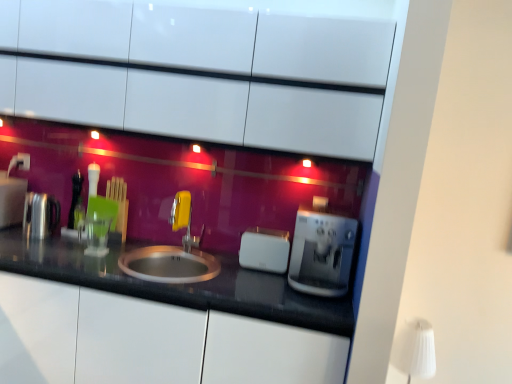
Question: Based on their positions, is white glossy cabinets at upper center located to the left or right of black granite countertop at center?

Choices:
 (A) right
 (B) left

Answer: (A)

Question: Is point [x=97, y=41] positioned closer to the camera than point [x=304, y=319]?

Choices:
 (A) closer
 (B) farther

Answer: (B)

Question: Estimate the real-world distances between objects in this image. Which object is farther from the polished stainless steel kettle at left, positioned as the 1th appliance in left-to-right order?

Choices:
 (A) satin silver sink at center
 (B) white plastic toaster at center, which ranks as the first appliance in right-to-left order
 (C) white plastic electric outlet at upper left
 (D) white fabric lampshade at upper right
 (E) yellow plastic faucet at center

Answer: (D)

Question: Estimate the real-world distances between objects in this image. Which object is farther from the white fabric lampshade at upper right?

Choices:
 (A) white glossy cabinets at upper center
 (B) polished stainless steel kettle at left, positioned as the second appliance in right-to-left order
 (C) yellow plastic faucet at center
 (D) white plastic electric outlet at upper left
 (E) satin silver coffee machine at center

Answer: (D)